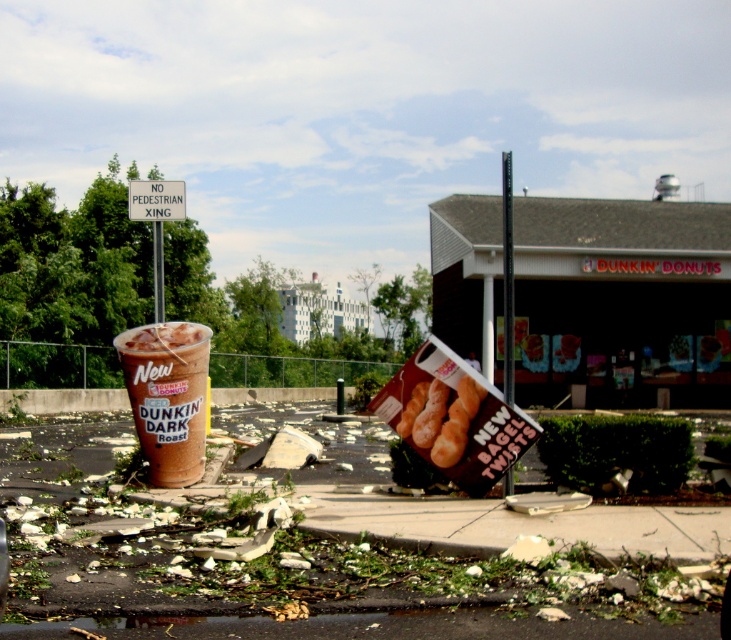
Question: Can you confirm if smooth concrete pavement at lower center is positioned above golden brown donut at center?

Choices:
 (A) yes
 (B) no

Answer: (B)

Question: Does smooth concrete pavement at lower center have a larger size compared to matte plastic cup at center-left?

Choices:
 (A) yes
 (B) no

Answer: (A)

Question: Considering the real-world distances, which object is farthest from the smooth concrete pavement at lower center?

Choices:
 (A) golden brown donut at center
 (B) matte plastic cup at center-left

Answer: (B)

Question: Is smooth concrete pavement at lower center above golden brown donut at center?

Choices:
 (A) yes
 (B) no

Answer: (B)

Question: Among these points, which one is nearest to the camera?

Choices:
 (A) (170, 557)
 (B) (423, 442)

Answer: (A)

Question: Which of the following is the farthest from the observer?

Choices:
 (A) (151, 212)
 (B) (420, 438)
 (C) (156, 632)

Answer: (A)